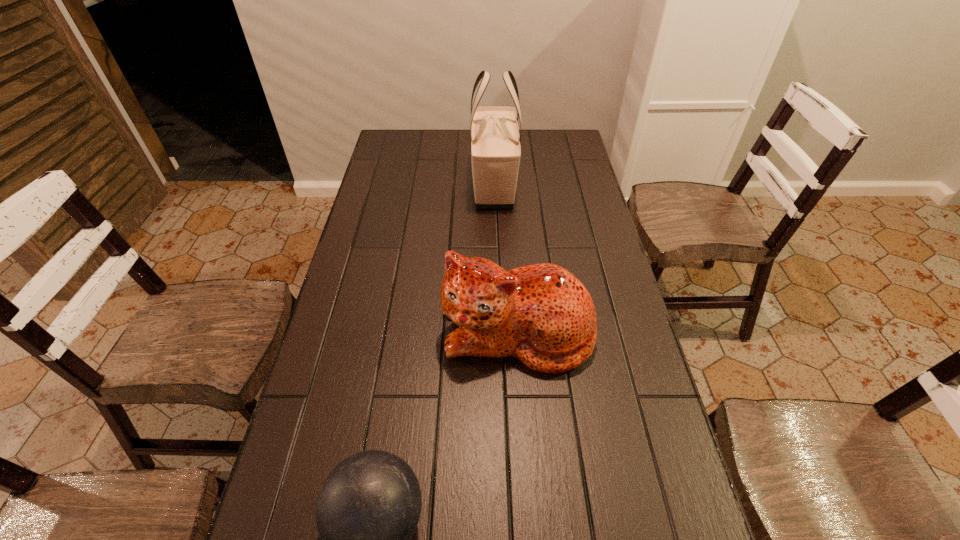
The height and width of the screenshot is (540, 960). I want to click on the tallest object, so click(494, 135).

Where is `shopping bag`? shopping bag is located at coordinates (494, 135).

Locate an element on the screen. The width and height of the screenshot is (960, 540). the second shortest object is located at coordinates (542, 314).

You are a GUI agent. You are given a task and a screenshot of the screen. Output one action in this format:
    pyautogui.click(x=<x>, y=<y>)
    Task: Click on the cat
    
    Given the screenshot: What is the action you would take?
    pyautogui.click(x=542, y=314)

Locate an element on the screen. Image resolution: width=960 pixels, height=540 pixels. free space located 0.200m with handles facing forward on the tallest object is located at coordinates (496, 253).

This screenshot has height=540, width=960. In order to click on vacant space located 0.220m on the face of the cat in this screenshot , I will do `click(527, 468)`.

Where is `object that is at the right edge`? object that is at the right edge is located at coordinates (542, 314).

In the image, there is a desktop. At what (x,y) coordinates should I click in order to perform the action: click on vacant space at the far edge. Please return your answer as a coordinate pair (x, y). The image size is (960, 540). Looking at the image, I should click on (443, 143).

Identify the location of vacant space at the left edge. (324, 398).

In the image, there is a desktop. Find the location of `vacant area at the right edge`. vacant area at the right edge is located at coordinates (604, 227).